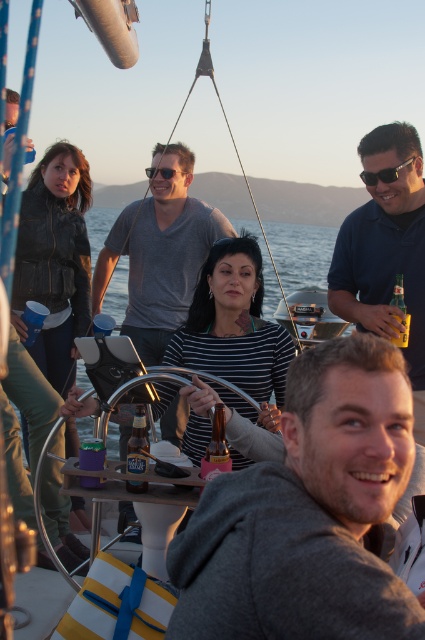
You are a photographer on the boat and want to capture both the gray hoodie at center and the matte gray shirt at center in a single frame. Which object should you focus on first to ensure both are in the frame?

The gray hoodie at center is shorter than the matte gray shirt at center, so you should focus on the matte gray shirt at center first to ensure both are in the frame.

You are a photographer trying to capture a group photo of the people on the boat. You notice the blue polo shirt at upper right and the matte gray shirt at center. Based on their sizes in the image, which shirt should you focus on to ensure it appears larger in the final photo?

The matte gray shirt at center should be focused on to ensure it appears larger in the final photo because its width is greater than the blue polo shirt at upper right.